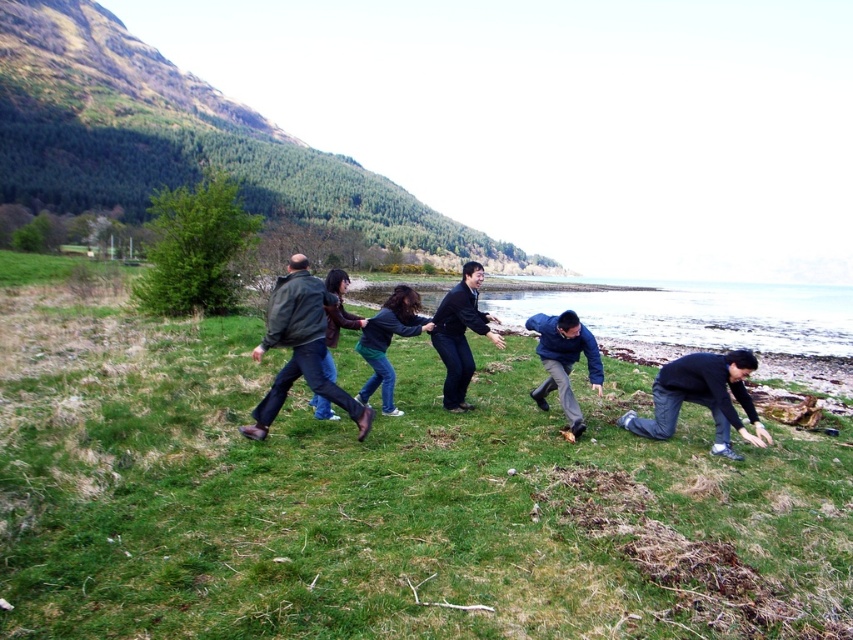
Which is above, green grassy at center or brown leather jacket at center?

brown leather jacket at center is higher up.

Who is more forward, (824, 484) or (340, 317)?

Positioned in front is point (824, 484).

Is point (206, 573) positioned behind point (326, 401)?

No, (206, 573) is in front of (326, 401).

Where is `green grassy at center`? green grassy at center is located at coordinates (381, 499).

Between dark blue sweater at center and blue denim jeans at center, which one appears on the left side from the viewer's perspective?

Positioned to the left is dark blue sweater at center.

Is point (456, 291) farther from camera compared to point (524, 324)?

That is False.

This screenshot has height=640, width=853. In order to click on dark blue sweater at center in this screenshot , I will do `click(460, 333)`.

The height and width of the screenshot is (640, 853). I want to click on dark blue sweater at center, so click(x=460, y=333).

Which is in front, point (711, 368) or point (381, 394)?

Point (711, 368) is more forward.

Does dark blue jeans at lower right appear over dark blue jeans at center?

Actually, dark blue jeans at lower right is below dark blue jeans at center.

You are a GUI agent. You are given a task and a screenshot of the screen. Output one action in this format:
    pyautogui.click(x=<x>, y=<y>)
    Task: Click on the dark blue jeans at lower right
    The width and height of the screenshot is (853, 640).
    Given the screenshot: What is the action you would take?
    pyautogui.click(x=701, y=397)